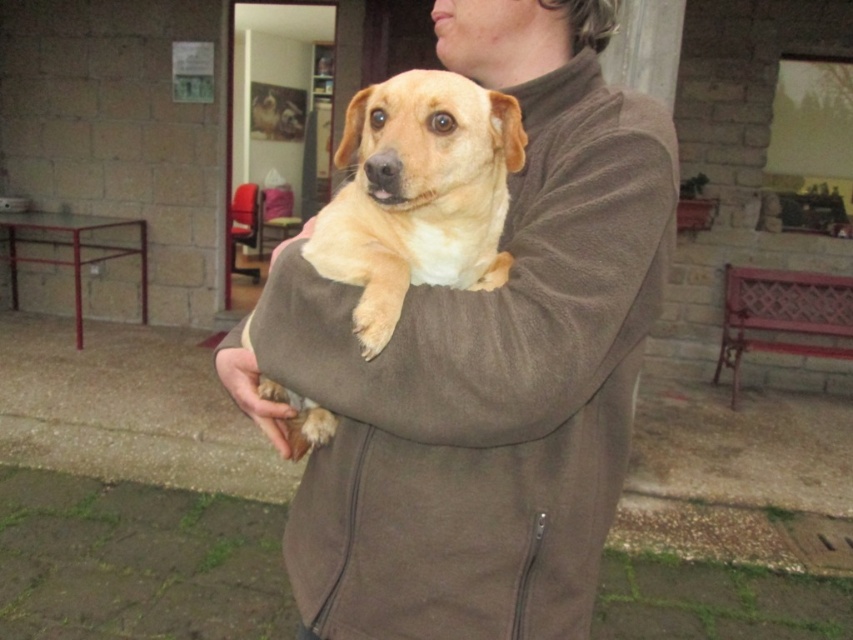
You are a photographer trying to capture a closeup shot of the light brown fur at center while ensuring the matte brown jacket at center is still visible in the frame. Given their size difference, which object should you focus on to include both in the composition?

The matte brown jacket at center is larger than the light brown fur at center, so focusing on the matte brown jacket at center will allow both to be captured in the frame while maintaining visibility of the smaller light brown fur at center.

You are standing in the scene and want to locate the matte brown jacket at center. Where exactly would you look?

The matte brown jacket at center is located at point 0.573 on the x axis and 0.566 on the y axis.